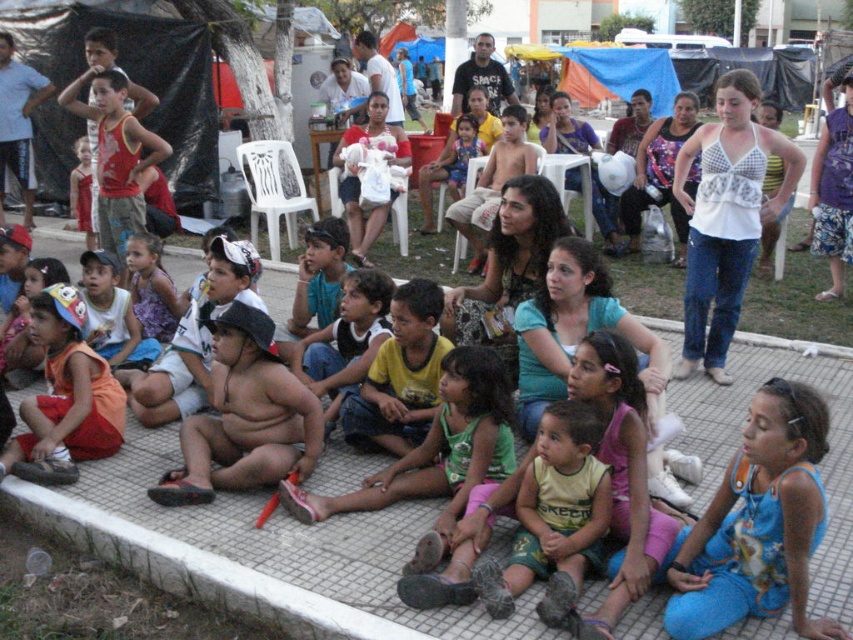
You are standing at the edge of the platform and see the point marked at coordinates (244,417). What is the closest object to that point?

The closest object to the point marked at coordinates (244,417) is the fat child at center.